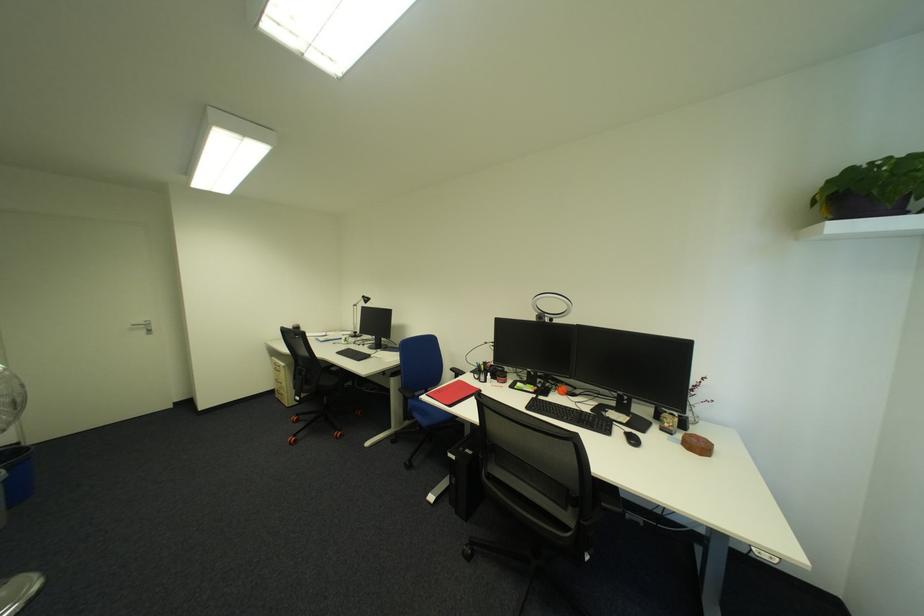
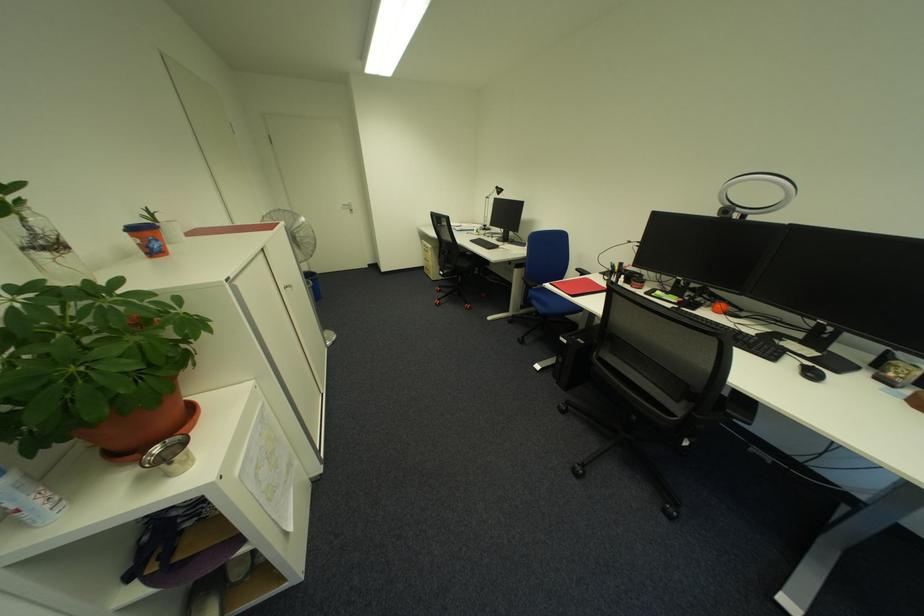
How did the camera likely rotate?

The rotation direction of the camera is left-down.